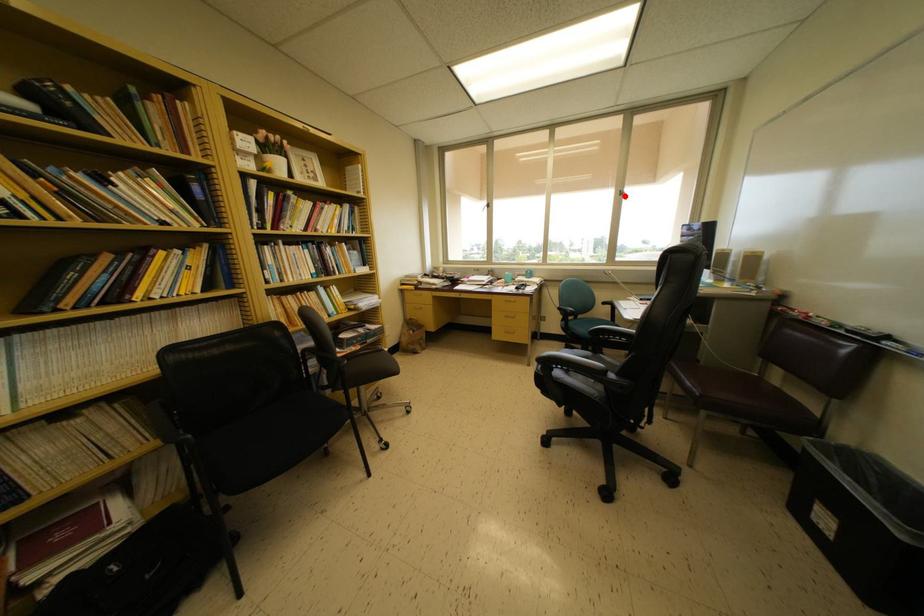
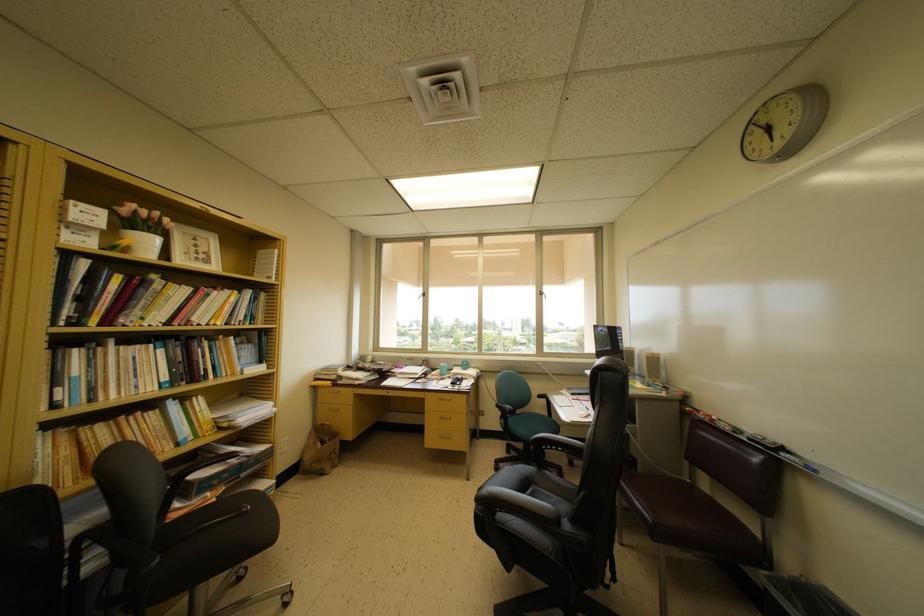
The point at the highlighted location is marked in the first image. Where is the corresponding point in the second image?

(543, 297)